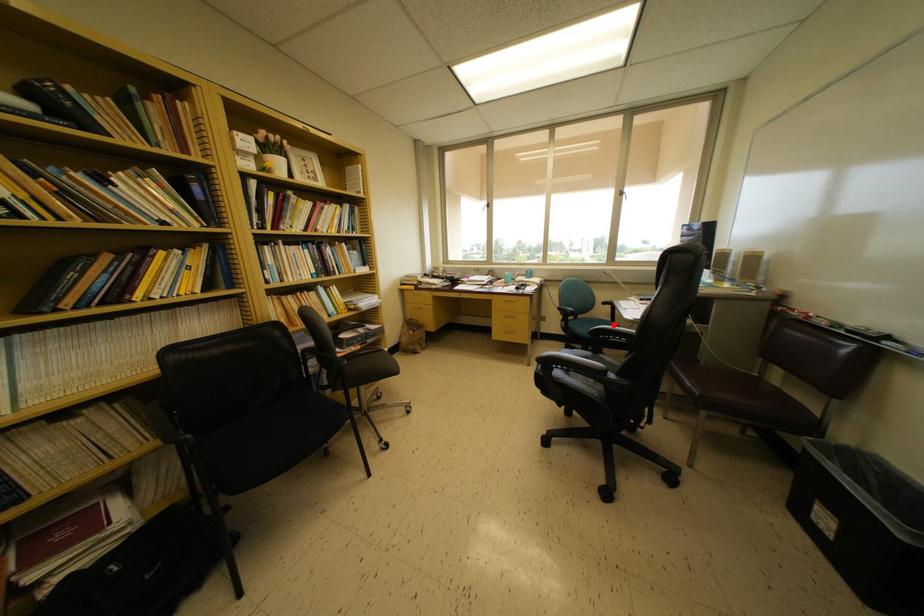
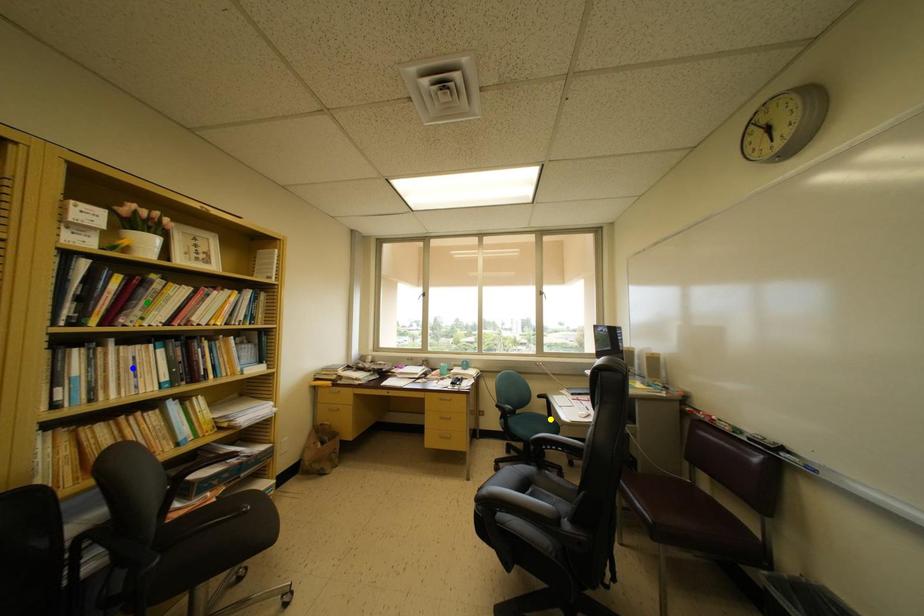
Question: I am providing you with two images of the same scene from different viewpoints. A red point is marked on the first image. You are given multiple points on the second image. Which spot in image 2 lines up with the point in image 1?

Choices:
 (A) yellow point
 (B) green point
 (C) blue point

Answer: (A)